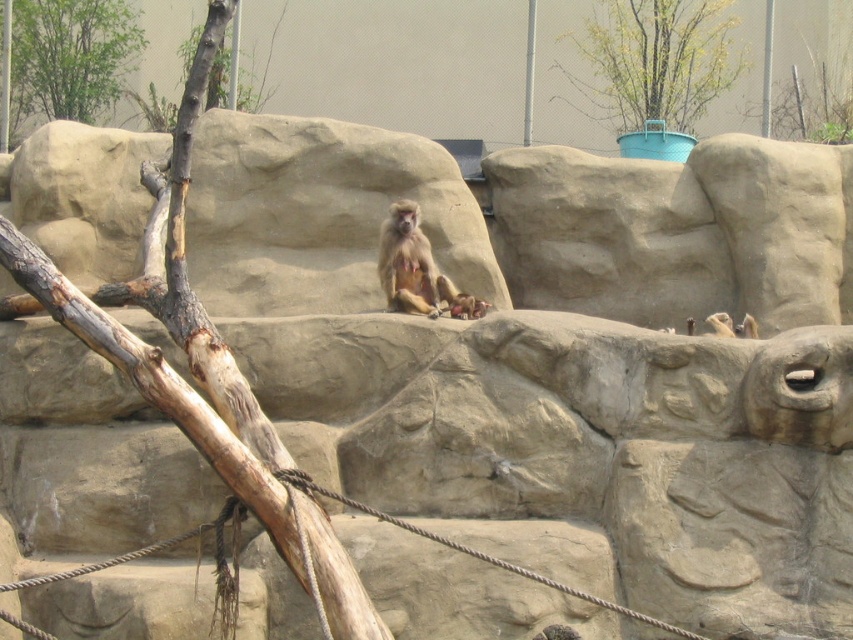
Does green plastic pot at upper center have a smaller size compared to golden fur monkey at center?

No.

Between green plastic pot at upper center and golden fur monkey at center, which one has more height?

green plastic pot at upper center is taller.

The height and width of the screenshot is (640, 853). I want to click on green plastic pot at upper center, so click(654, 61).

Is golden fur monkey at center shorter than brown furry monkey at center?

No, golden fur monkey at center is not shorter than brown furry monkey at center.

Where is `golden fur monkey at center`? The width and height of the screenshot is (853, 640). golden fur monkey at center is located at coordinates (409, 262).

Find the location of a particular element. golden fur monkey at center is located at coordinates (409, 262).

This screenshot has height=640, width=853. In order to click on golden fur monkey at center in this screenshot , I will do `click(409, 262)`.

Can you confirm if green leafy tree at upper left is positioned below golden fur monkey at center?

Incorrect, green leafy tree at upper left is not positioned below golden fur monkey at center.

Is green leafy tree at upper left taller than golden fur monkey at center?

Indeed, green leafy tree at upper left has a greater height compared to golden fur monkey at center.

Which is behind, point (97, 48) or point (399, 230)?

The point (97, 48) is behind.

Locate an element on the screen. Image resolution: width=853 pixels, height=640 pixels. green leafy tree at upper left is located at coordinates (70, 58).